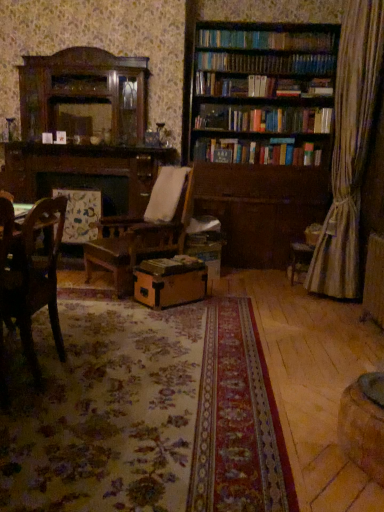
The image size is (384, 512). What do you see at coordinates (262, 92) in the screenshot?
I see `brown wooden bookcase at upper right` at bounding box center [262, 92].

You are a GUI agent. You are given a task and a screenshot of the screen. Output one action in this format:
    pyautogui.click(x=<x>, y=<y>)
    Task: Click on the brown cardboard box at center
    The width and height of the screenshot is (384, 512).
    Given the screenshot: What is the action you would take?
    pyautogui.click(x=170, y=281)

Find the location of a particular element. The width and height of the screenshot is (384, 512). brown wooden bookcase at upper right is located at coordinates (262, 92).

Is brown cardboard box at center shorter than wooden chair at left?

Yes.

Looking at this image, which object is wider, brown cardboard box at center or wooden chair at left?

brown cardboard box at center.

Consider the image. Which of these two, wooden chair at left or brown cardboard box at center, is thinner?

wooden chair at left is thinner.

Considering the relative positions of wooden chair at left and brown cardboard box at center in the image provided, is wooden chair at left to the left or to the right of brown cardboard box at center?

Clearly, wooden chair at left is on the left of brown cardboard box at center in the image.

Based on the photo, is wooden chair at left far from brown cardboard box at center?

No.

From the image's perspective, which one is positioned higher, wooden chair at left or brown cardboard box at center?

From the image's view, wooden chair at left is above.

Is brown wooden bookcase at upper right located outside brown cardboard box at center?

brown wooden bookcase at upper right is positioned outside brown cardboard box at center.

Is brown wooden bookcase at upper right wider than brown cardboard box at center?

Yes, brown wooden bookcase at upper right is wider than brown cardboard box at center.

Considering the positions of points (264, 123) and (156, 303), is point (264, 123) closer to camera compared to point (156, 303)?

That is False.

How much distance is there between wooden chair at left and brown wooden bookcase at upper right?

wooden chair at left and brown wooden bookcase at upper right are 9.46 feet apart.

How many degrees apart are the facing directions of wooden chair at left and brown wooden bookcase at upper right?

89.8 degrees.

Considering the sizes of objects wooden chair at left and brown wooden bookcase at upper right in the image provided, who is wider, wooden chair at left or brown wooden bookcase at upper right?

brown wooden bookcase at upper right is wider.

From a real-world perspective, is wooden chair at left over brown wooden bookcase at upper right?

No, from a real-world perspective, wooden chair at left is not above brown wooden bookcase at upper right.

Is brown cardboard box at center to the left of brown wooden bookcase at upper right from the viewer's perspective?

Yes, brown cardboard box at center is to the left of brown wooden bookcase at upper right.

How many degrees apart are the facing directions of brown cardboard box at center and brown wooden bookcase at upper right?

brown cardboard box at center and brown wooden bookcase at upper right are facing 44.1 degrees away from each other.

From a real-world perspective, is brown cardboard box at center on brown wooden bookcase at upper right?

Incorrect, from a real-world perspective, brown cardboard box at center is lower than brown wooden bookcase at upper right.

In the scene shown: Is brown cardboard box at center far away from brown wooden bookcase at upper right?

Yes, brown cardboard box at center is far from brown wooden bookcase at upper right.

Can we say brown wooden bookcase at upper right lies outside wooden chair at left?

Yes.

From the image's perspective, which one is positioned lower, brown wooden bookcase at upper right or wooden chair at left?

From the image's view, wooden chair at left is below.

Based on the photo, from a real-world perspective, is brown wooden bookcase at upper right physically located above or below wooden chair at left?

In terms of real-world spatial position, brown wooden bookcase at upper right is above wooden chair at left.

Is brown wooden bookcase at upper right with wooden chair at left?

No, brown wooden bookcase at upper right is not next to wooden chair at left.

At what (x,y) coordinates should I click in order to perform the action: click on cardboard box below the wooden chair at left (from the image's perspective). Please return your answer as a coordinate pair (x, y). This screenshot has height=512, width=384. Looking at the image, I should click on (170, 281).

Where is `cardboard box behind the wooden chair at left`? cardboard box behind the wooden chair at left is located at coordinates (170, 281).

From the image, which object appears to be nearer to wooden chair at left, brown cardboard box at center or brown wooden bookcase at upper right?

brown cardboard box at center.

Looking at the image, which one is located closer to wooden chair at left, brown wooden bookcase at upper right or brown cardboard box at center?

brown cardboard box at center lies closer to wooden chair at left than the other object.

Considering their positions, is brown cardboard box at center positioned further to brown wooden bookcase at upper right than wooden chair at left?

wooden chair at left is positioned further to the anchor brown wooden bookcase at upper right.

Which object lies further to the anchor point brown wooden bookcase at upper right, wooden chair at left or brown cardboard box at center?

The object further to brown wooden bookcase at upper right is wooden chair at left.

Which object lies further to the anchor point brown cardboard box at center, wooden chair at left or brown wooden bookcase at upper right?

Among the two, brown wooden bookcase at upper right is located further to brown cardboard box at center.

Considering their positions, is brown wooden bookcase at upper right positioned further to brown cardboard box at center than wooden chair at left?

Answer: brown wooden bookcase at upper right is further to brown cardboard box at center.

The image size is (384, 512). What are the coordinates of `cardboard box positioned between wooden chair at left and brown wooden bookcase at upper right from near to far` in the screenshot? It's located at (170, 281).